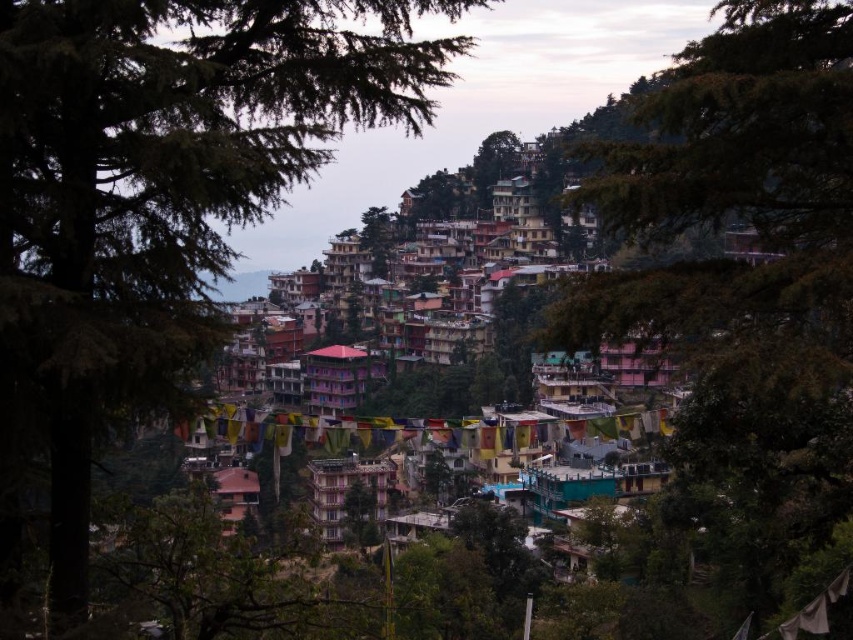
You are an observer standing at the base of the hill looking up at the residential area. Which tree, the green textured tree at upper left or the green leafy tree at center, appears taller from your perspective?

The green leafy tree at center appears taller than the green textured tree at upper left from your perspective.

You are a drone operator trying to capture a photo of the residential area. The drone is currently at the position of the green textured tree at upper left. To avoid obstacles, you need to move the drone 0.1 units to the right and 0.05 units downward. What are the new coordinates of the drone?

The green textured tree at upper left is at point (155,200). Moving 0.1 units right increases the x coordinate to 0.414, and moving 0.05 units downward decreases the y coordinate to 0.134. The new coordinates are (113,264).